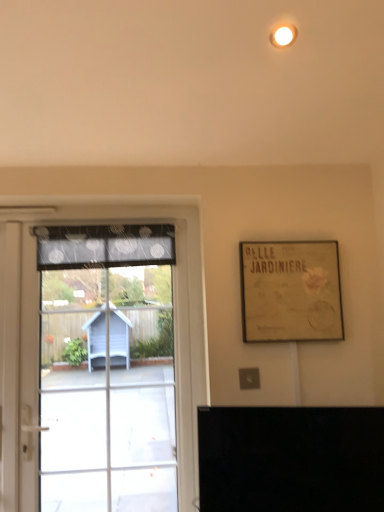
Question: Does gold textured paper at upper right have a smaller size compared to black glossy tv at lower center?

Choices:
 (A) no
 (B) yes

Answer: (B)

Question: Does gold textured paper at upper right have a lesser height compared to black glossy tv at lower center?

Choices:
 (A) no
 (B) yes

Answer: (A)

Question: Is the depth of gold textured paper at upper right less than that of black glossy tv at lower center?

Choices:
 (A) yes
 (B) no

Answer: (B)

Question: From the image's perspective, does gold textured paper at upper right appear higher than black glossy tv at lower center?

Choices:
 (A) yes
 (B) no

Answer: (A)

Question: Considering the relative positions of gold textured paper at upper right and black glossy tv at lower center in the image provided, is gold textured paper at upper right to the left of black glossy tv at lower center from the viewer's perspective?

Choices:
 (A) no
 (B) yes

Answer: (A)

Question: Considering their positions, is transparent glass door at left located in front of or behind dark gray sheer curtain at left?

Choices:
 (A) front
 (B) behind

Answer: (A)

Question: From their relative heights in the image, would you say transparent glass door at left is taller or shorter than dark gray sheer curtain at left?

Choices:
 (A) tall
 (B) short

Answer: (A)

Question: Visually, is transparent glass door at left positioned to the left or to the right of dark gray sheer curtain at left?

Choices:
 (A) left
 (B) right

Answer: (B)

Question: Does point (193, 298) appear closer or farther from the camera than point (158, 238)?

Choices:
 (A) closer
 (B) farther

Answer: (A)

Question: In terms of height, does dark gray sheer curtain at left look taller or shorter compared to transparent glass door at left?

Choices:
 (A) tall
 (B) short

Answer: (B)

Question: Is point (115, 256) closer or farther from the camera than point (182, 287)?

Choices:
 (A) closer
 (B) farther

Answer: (A)

Question: Based on their positions, is dark gray sheer curtain at left located to the left or right of transparent glass door at left?

Choices:
 (A) left
 (B) right

Answer: (A)

Question: Is dark gray sheer curtain at left in front of or behind transparent glass door at left in the image?

Choices:
 (A) front
 (B) behind

Answer: (B)

Question: Is point (288, 315) positioned closer to the camera than point (268, 419)?

Choices:
 (A) closer
 (B) farther

Answer: (B)

Question: Do you think gold textured paper at upper right is within black glossy tv at lower center, or outside of it?

Choices:
 (A) inside
 (B) outside

Answer: (B)